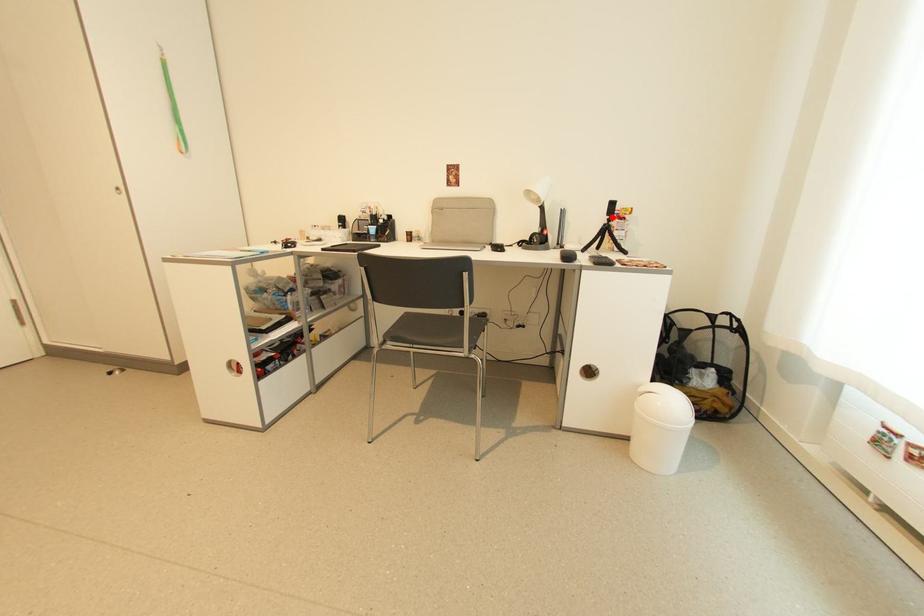
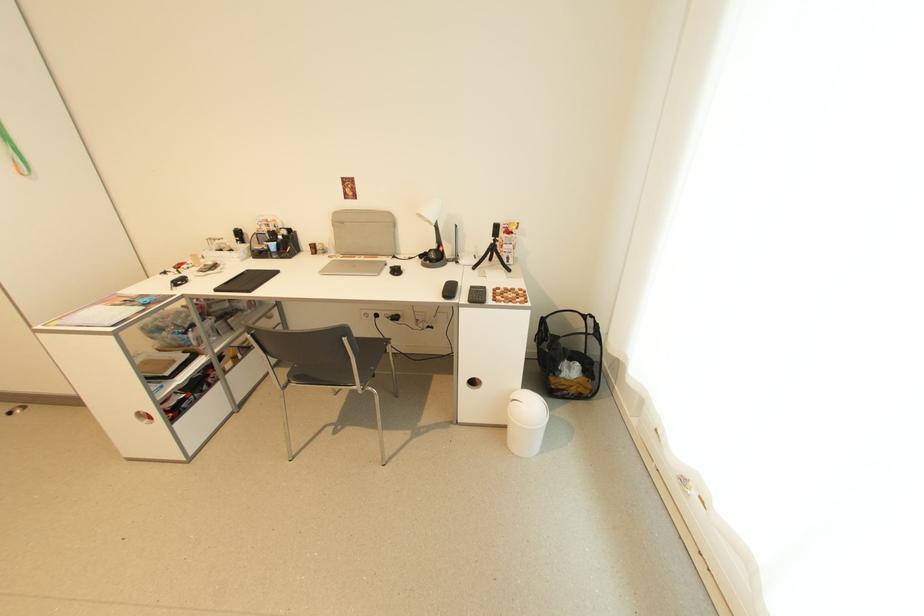
Locate, in the second image, the point that corresponds to the highlighted location in the first image.

(497, 238)